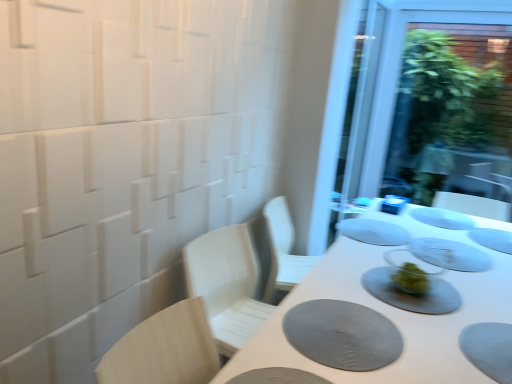
Image resolution: width=512 pixels, height=384 pixels. Identify the location of free point above matte white plate at center, acting as the 3th tableware starting from the back (from a real-world perspective). (372, 225).